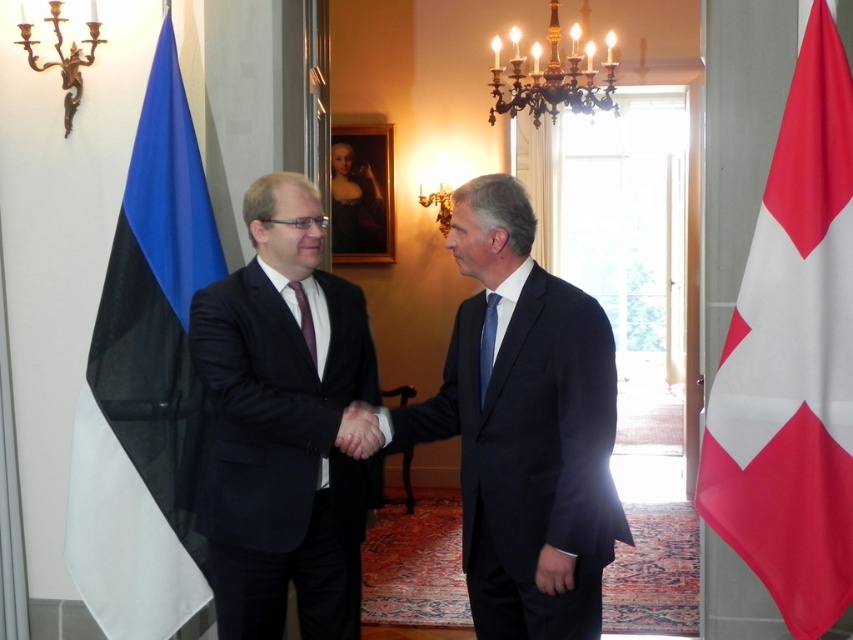
You are an event planner setting up a camera to capture the handshake between the two individuals in the formal meeting. The camera must be placed at point (524, 428) to ensure the dark blue suit at center is centered in the frame. Will this placement also capture both individuals shaking hands?

Yes, placing the camera at point (524, 428) will center the dark blue suit at center in the frame, and since both individuals are positioned centrally in the frame shaking hands, this placement will capture both individuals shaking hands.

You are a photographer adjusting your camera settings to capture the handshake between the matte black suit at center and the dark blue suit at center. Which suit will appear closer to the camera in the photo?

The matte black suit at center will appear closer to the camera since it is positioned further to the viewer compared to the dark blue suit at center.

In the scene shown: You are a photographer in the room and want to capture a photo of the dark blue suit at center and the purple satin tie at center. Which one should you focus on first if you need to adjust your camera focus from near to far?

The dark blue suit at center is taller than the purple satin tie at center, so you should focus on the dark blue suit at center first as it is farther away.